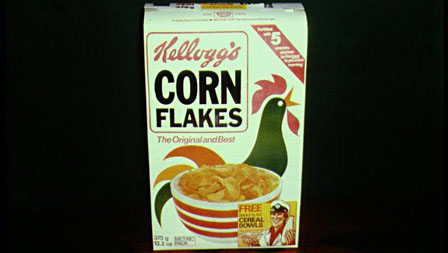
In order to click on box in this screenshot , I will do `click(230, 148)`.